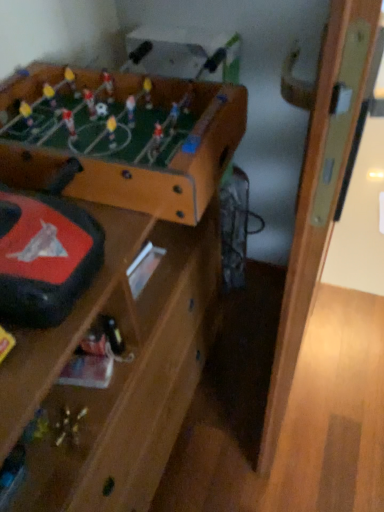
Question: Is metallic silver toy at center surrounding wooden door at right?

Choices:
 (A) no
 (B) yes

Answer: (A)

Question: Does metallic silver toy at center have a lesser height compared to wooden door at right?

Choices:
 (A) no
 (B) yes

Answer: (B)

Question: Does metallic silver toy at center turn towards wooden door at right?

Choices:
 (A) yes
 (B) no

Answer: (A)

Question: From a real-world perspective, is metallic silver toy at center positioned under wooden door at right based on gravity?

Choices:
 (A) no
 (B) yes

Answer: (A)

Question: Is metallic silver toy at center taller than wooden door at right?

Choices:
 (A) yes
 (B) no

Answer: (B)

Question: From the image's perspective, does metallic silver toy at center appear lower than wooden door at right?

Choices:
 (A) no
 (B) yes

Answer: (B)

Question: Can you confirm if wooden foosball table at upper left is taller than wooden door at right?

Choices:
 (A) no
 (B) yes

Answer: (A)

Question: Can you confirm if wooden foosball table at upper left is bigger than wooden door at right?

Choices:
 (A) yes
 (B) no

Answer: (B)

Question: Can you confirm if wooden foosball table at upper left is wider than wooden door at right?

Choices:
 (A) yes
 (B) no

Answer: (A)

Question: Can you confirm if wooden foosball table at upper left is thinner than wooden door at right?

Choices:
 (A) yes
 (B) no

Answer: (B)

Question: Is wooden foosball table at upper left touching wooden door at right?

Choices:
 (A) yes
 (B) no

Answer: (B)

Question: From the image's perspective, is wooden foosball table at upper left on top of wooden door at right?

Choices:
 (A) no
 (B) yes

Answer: (B)

Question: Considering the relative sizes of wooden door at right and wooden foosball table at upper left in the image provided, is wooden door at right thinner than wooden foosball table at upper left?

Choices:
 (A) no
 (B) yes

Answer: (B)